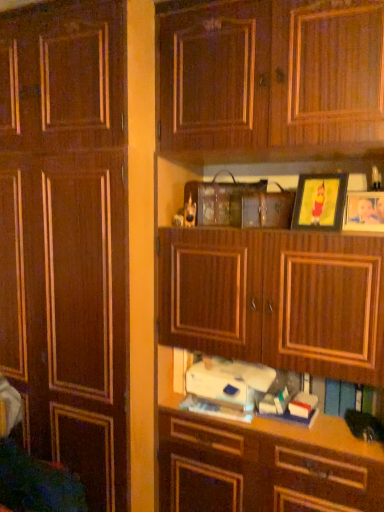
Question: From the image's perspective, is wooden photo frame at upper right, the first picture frame when ordered from right to left, located above or below matte gold picture frame at upper right, placed as the first picture frame when sorted from left to right?

Choices:
 (A) below
 (B) above

Answer: (A)

Question: Considering the positions of point (375, 227) and point (309, 226), is point (375, 227) closer or farther from the camera than point (309, 226)?

Choices:
 (A) farther
 (B) closer

Answer: (B)

Question: Considering the real-world distances, which object is closest to the wooden photo frame at upper right, the first picture frame when ordered from right to left?

Choices:
 (A) matte gold picture frame at upper right, which is the 2th picture frame in right-to-left order
 (B) white matte book at center
 (C) white fabric swivel chair at lower left
 (D) wooden cabinet at center

Answer: (A)

Question: Which of these objects is positioned closest to the white matte book at center?

Choices:
 (A) matte gold picture frame at upper right, placed as the first picture frame when sorted from left to right
 (B) white fabric swivel chair at lower left
 (C) wooden photo frame at upper right, the 2th picture frame when ordered from left to right
 (D) wooden cabinet at center

Answer: (A)